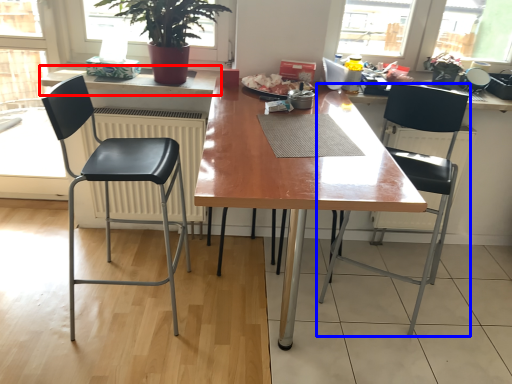
Question: Among these objects, which one is nearest to the camera, counter top (highlighted by a red box) or chair (highlighted by a blue box)?

Choices:
 (A) counter top
 (B) chair

Answer: (B)